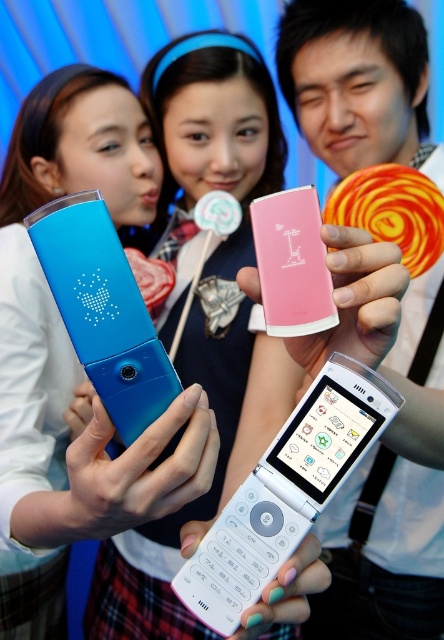
Question: Is blue glossy phone at left wider than blue matte phone at center?

Choices:
 (A) no
 (B) yes

Answer: (B)

Question: Which point is farther from the camera taking this photo?

Choices:
 (A) (171, 152)
 (B) (425, 618)

Answer: (A)

Question: Which object is the farthest from the pink matte ipod at center?

Choices:
 (A) pink matte flip phone at center
 (B) blue matte phone at center
 (C) blue glossy ipod at center

Answer: (A)

Question: Estimate the real-world distances between objects in this image. Which object is closer to the blue glossy phone at left?

Choices:
 (A) blue glossy ipod at center
 (B) pink matte flip phone at center
 (C) white plastic flip phone at center
 (D) pink matte ipod at center

Answer: (C)

Question: Does blue matte phone at center have a greater width compared to pink matte ipod at center?

Choices:
 (A) yes
 (B) no

Answer: (A)

Question: Is white plastic flip phone at center smaller than blue glossy ipod at center?

Choices:
 (A) no
 (B) yes

Answer: (A)